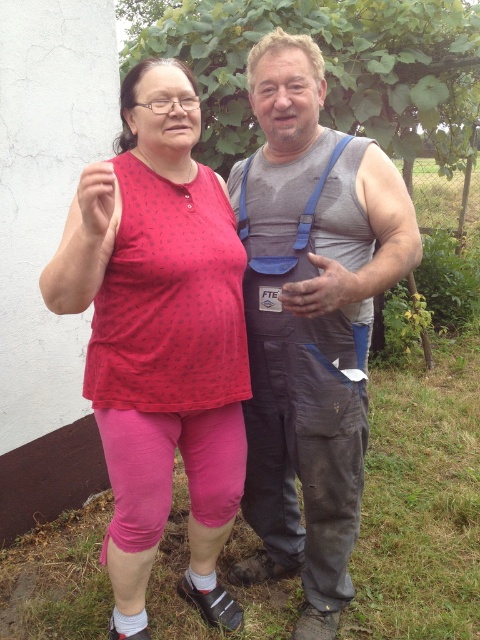
You are taking a photo of the matte pink leggings at left and the gray fabric tank top at center. Which one should you focus on first to ensure both are in focus?

You should focus on the matte pink leggings at left first because it is closer to the viewer than the gray fabric tank top at center, so focusing on the closer object will help both be in focus.

You are standing in a garden and see two people. One has matte pink leggings at left and the other is wearing gray sleeveless shirt and dark overalls with blue straps. There is a point marked at coordinates (x=159, y=333). Which person is closest to this point?

The point at coordinates (x=159, y=333) indicates the location of the matte pink leggings at left, so the person with the matte pink leggings at left is closest to this point.

You are a photographer trying to capture a photo of the matte pink leggings at left and the gray fabric tank top at center. Which object should you focus on first if you want to ensure both are in focus without adjusting the camera settings?

The matte pink leggings at left is not as tall as the gray fabric tank top at center, so you should focus on the taller gray fabric tank top at center first to ensure both are in focus.